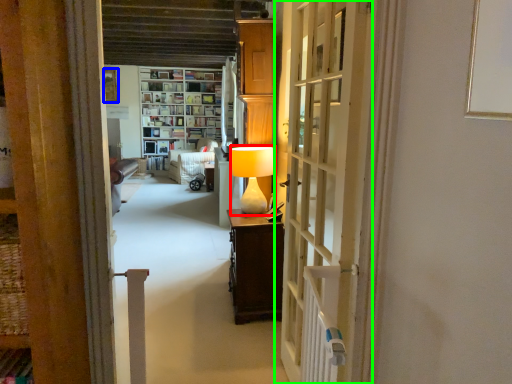
Question: Based on their relative distances, which object is nearer to table lamp (highlighted by a red box)? Choose from picture frame (highlighted by a blue box) and door (highlighted by a green box).

Choices:
 (A) picture frame
 (B) door

Answer: (B)